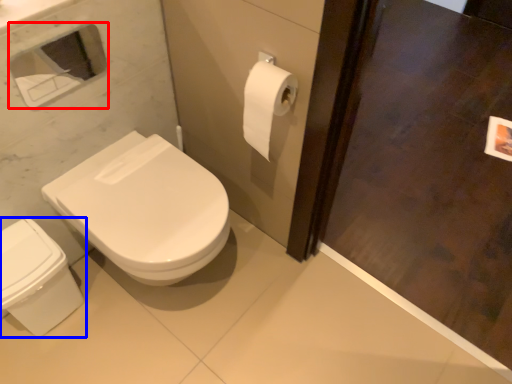
Question: Which object appears farthest to the camera in this image, medicine cabinet (highlighted by a red box) or bidet (highlighted by a blue box)?

Choices:
 (A) medicine cabinet
 (B) bidet

Answer: (B)